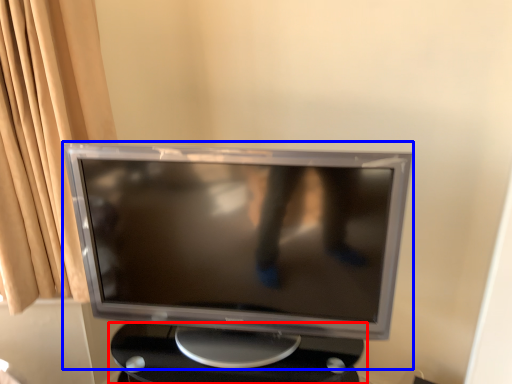
Question: Among these objects, which one is farthest to the camera, table (highlighted by a red box) or computer monitor (highlighted by a blue box)?

Choices:
 (A) table
 (B) computer monitor

Answer: (A)